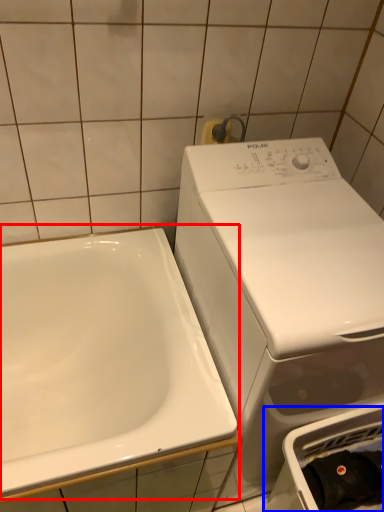
Question: Which point is closer to the camera, sink (highlighted by a red box) or dish washer (highlighted by a blue box)?

Choices:
 (A) sink
 (B) dish washer

Answer: (A)